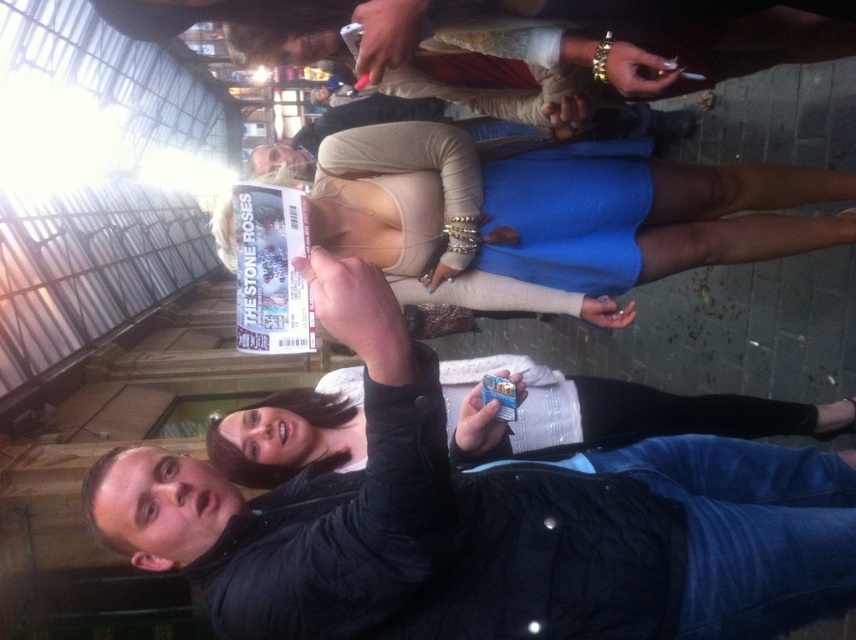
You are a photographer at the event and want to take a clear photo of the matte blue dress at center without the matte black jacket at upper center blocking it. How should you adjust your position?

Move forward towards the matte blue dress at center so that it is no longer blocked by the matte black jacket at upper center behind it.

Consider the image. You are standing at the point with coordinates point (744,204) and want to move to the point with coordinates point (496,141). Which direction should you move? The answer must be one of the following options, and you must choose the most appropriate one. The options are up, down, left, right, forward, backward, north, south, east, west, front, back, top, bottom, inside, outside, clockwise, counter clockwise, or any combination of these separated by commas. If you can answer with multiple directions, e

The point (744,204) is further to the viewer than point (496,141), so you should move backward to reach it.

You are a photographer at the event and want to capture a photo that includes both the matte blue dress at center and the matte black jacket at upper center. Which object should you focus on first to ensure both are in frame?

The matte blue dress at center is much taller as matte black jacket at upper center, so you should focus on the matte blue dress at center first to ensure both are in frame.